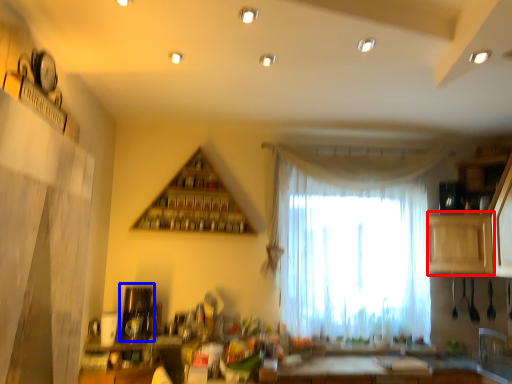
Question: Which point is further to the camera, cabinetry (highlighted by a red box) or appliance (highlighted by a blue box)?

Choices:
 (A) cabinetry
 (B) appliance

Answer: (A)